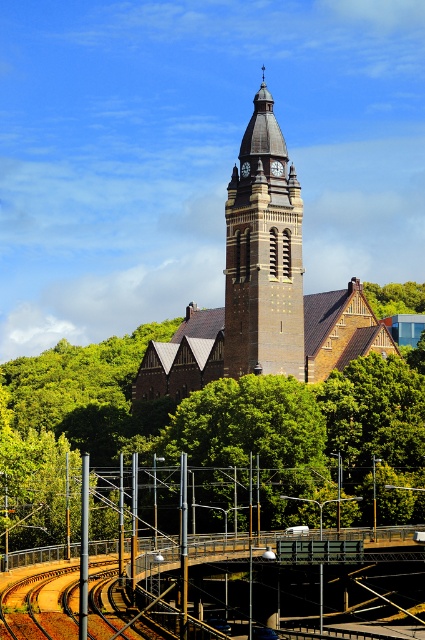
Which is below, brown stone clock tower at center or green leafy tree at upper center?

green leafy tree at upper center is below.

Can you confirm if brown stone clock tower at center is wider than green leafy tree at upper center?

In fact, brown stone clock tower at center might be narrower than green leafy tree at upper center.

Who is more distant from viewer, (x=229, y=355) or (x=371, y=285)?

The point (x=371, y=285) is behind.

This screenshot has height=640, width=425. In order to click on brown stone clock tower at center in this screenshot , I will do `click(263, 253)`.

Does green leafy tree at center have a greater width compared to brown stone clock tower at center?

Correct, the width of green leafy tree at center exceeds that of brown stone clock tower at center.

Does green leafy tree at center appear on the left side of brown stone clock tower at center?

Indeed, green leafy tree at center is positioned on the left side of brown stone clock tower at center.

Where is `green leafy tree at center`? This screenshot has width=425, height=640. green leafy tree at center is located at coordinates (215, 428).

Does point (28, 403) lie behind point (396, 284)?

That is False.

Which is in front, point (388, 438) or point (376, 292)?

Positioned in front is point (388, 438).

Is point (391, 413) positioned in front of point (377, 291)?

Yes, point (391, 413) is in front of point (377, 291).

You are a GUI agent. You are given a task and a screenshot of the screen. Output one action in this format:
    pyautogui.click(x=<x>, y=<y>)
    Task: Click on the green leafy tree at center
    The height and width of the screenshot is (640, 425).
    Given the screenshot: What is the action you would take?
    pyautogui.click(x=215, y=428)